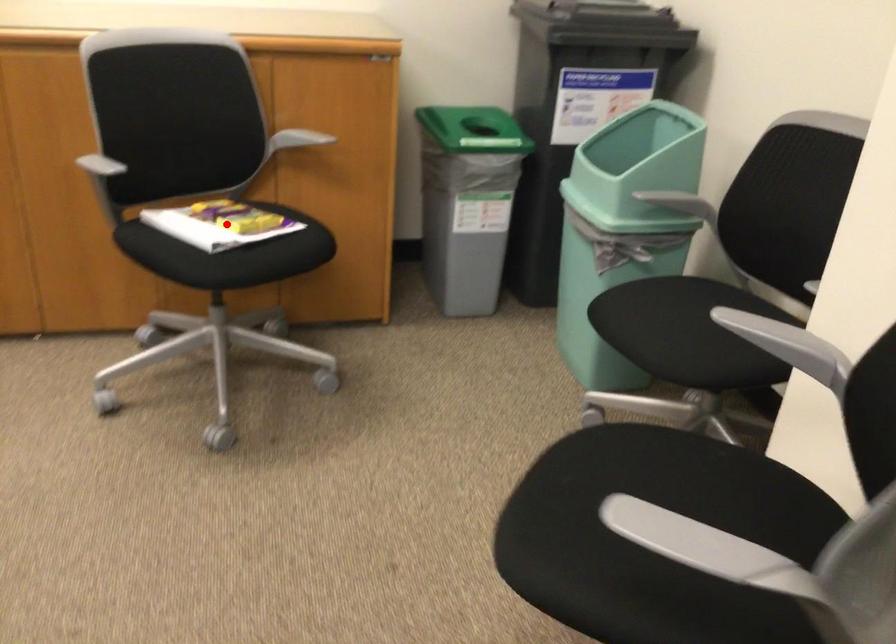
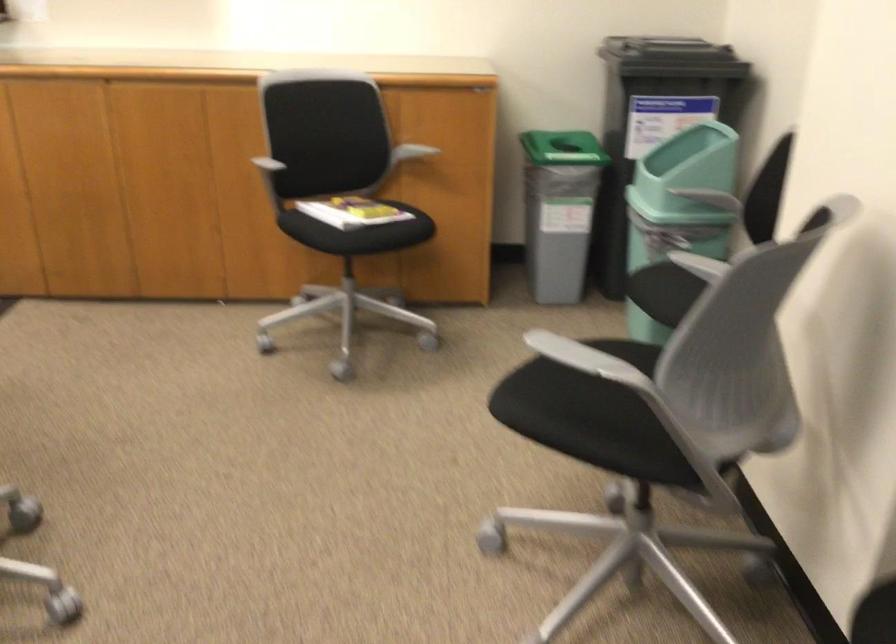
The point at the highlighted location is marked in the first image. Where is the corresponding point in the second image?

(351, 211)